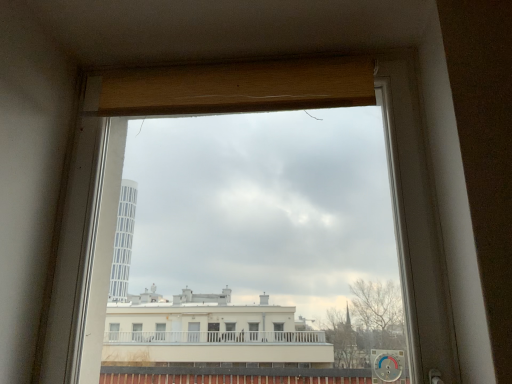
Image resolution: width=512 pixels, height=384 pixels. What do you see at coordinates (249, 111) in the screenshot?
I see `wooden frame at center` at bounding box center [249, 111].

The width and height of the screenshot is (512, 384). I want to click on wooden frame at center, so click(249, 111).

I want to click on wooden frame at center, so click(249, 111).